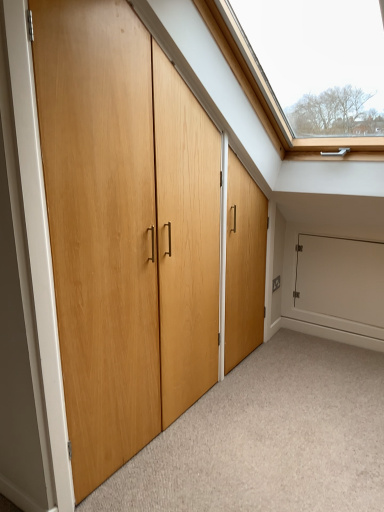
Question: Is light wood door at center not within white matte cabinet at lower right?

Choices:
 (A) yes
 (B) no

Answer: (A)

Question: Is light wood door at center surrounding white matte cabinet at lower right?

Choices:
 (A) yes
 (B) no

Answer: (B)

Question: Can you confirm if light wood door at center is thinner than white matte cabinet at lower right?

Choices:
 (A) yes
 (B) no

Answer: (B)

Question: Is the position of light wood door at center more distant than that of white matte cabinet at lower right?

Choices:
 (A) no
 (B) yes

Answer: (A)

Question: Would you consider light wood door at center to be distant from white matte cabinet at lower right?

Choices:
 (A) no
 (B) yes

Answer: (A)

Question: Considering the relative sizes of light wood door at center and white matte cabinet at lower right in the image provided, is light wood door at center smaller than white matte cabinet at lower right?

Choices:
 (A) yes
 (B) no

Answer: (B)

Question: Is white matte cabinet at lower right shorter than light wood door at center?

Choices:
 (A) yes
 (B) no

Answer: (B)

Question: Considering the relative positions of white matte cabinet at lower right and light wood door at center in the image provided, is white matte cabinet at lower right behind light wood door at center?

Choices:
 (A) yes
 (B) no

Answer: (A)

Question: Is white matte cabinet at lower right surrounding light wood door at center?

Choices:
 (A) yes
 (B) no

Answer: (B)

Question: Does white matte cabinet at lower right appear on the right side of light wood door at center?

Choices:
 (A) yes
 (B) no

Answer: (A)

Question: From the image's perspective, is white matte cabinet at lower right below light wood door at center?

Choices:
 (A) no
 (B) yes

Answer: (A)

Question: Is white matte cabinet at lower right taller than light wood door at center?

Choices:
 (A) no
 (B) yes

Answer: (B)

Question: Does natural wood door at center turn towards white matte cabinet at lower right?

Choices:
 (A) yes
 (B) no

Answer: (B)